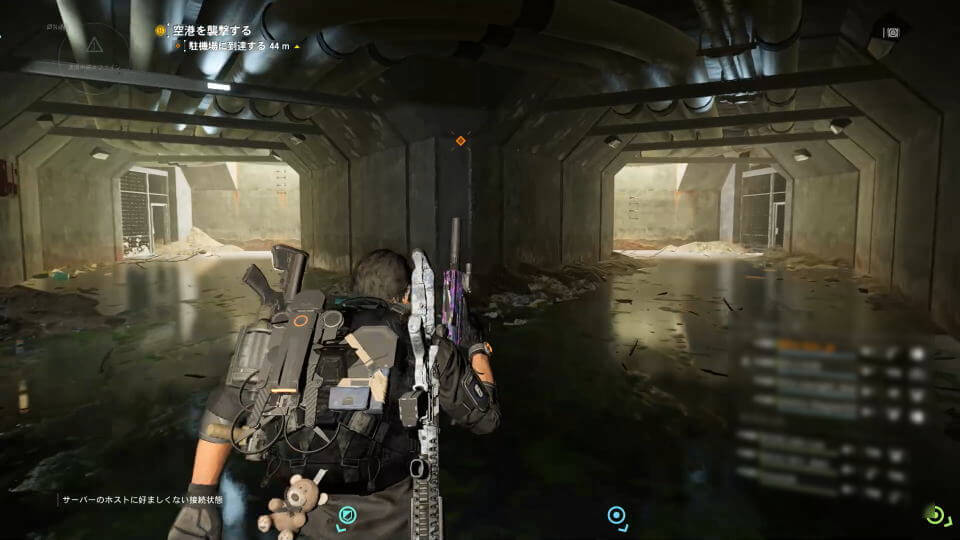
At what (x,y) coordinates should I click in order to perform the action: click on flooded room. Please return your answer as a coordinate pair (x, y). Image resolution: width=960 pixels, height=540 pixels. Looking at the image, I should click on (188, 310).